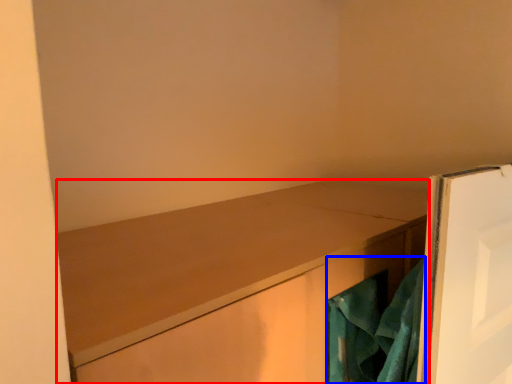
Question: Which of the following is the closest to the observer, cabinetry (highlighted by a red box) or laundry (highlighted by a blue box)?

Choices:
 (A) cabinetry
 (B) laundry

Answer: (A)